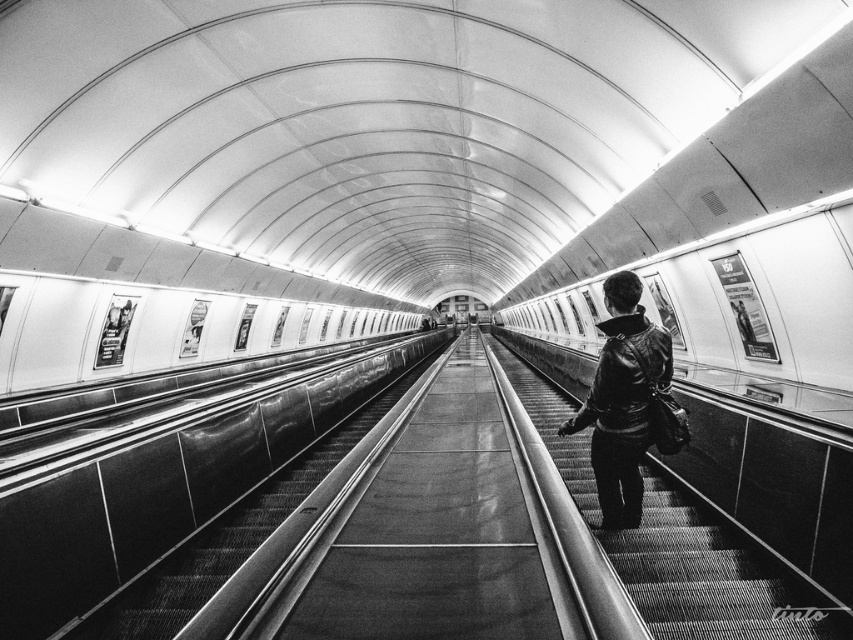
You are standing on the escalator in the subway station. You notice a point marked at coordinates (679, 541). What object is located at that point?

The point at coordinates (679, 541) indicates metallic escalator steps at center.